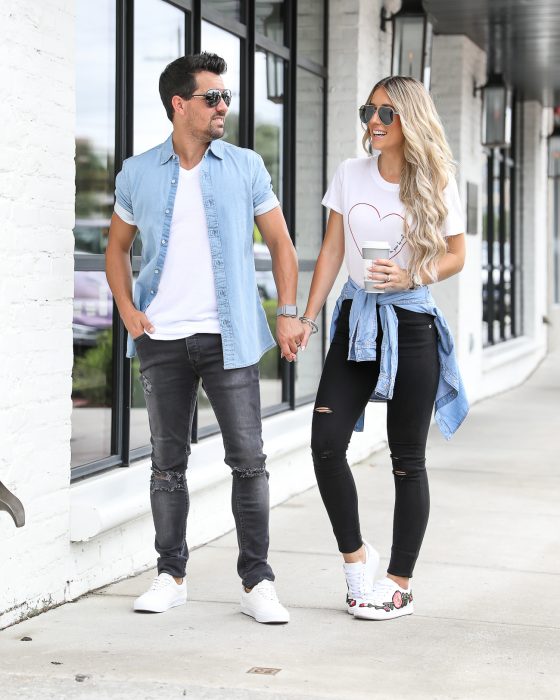
Locate an element on the screen. window is located at coordinates (94, 92), (139, 127), (235, 60), (272, 133), (508, 190), (496, 197), (485, 211).